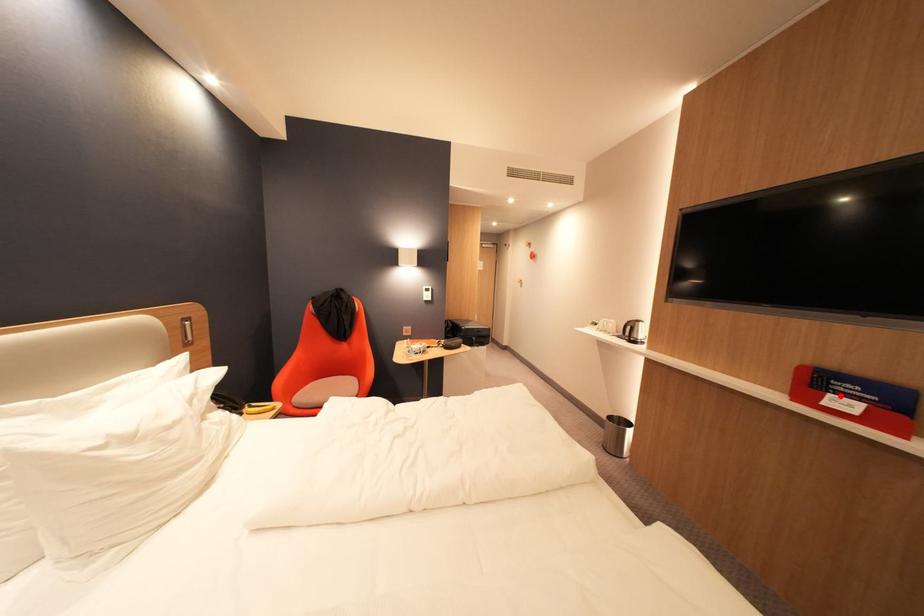
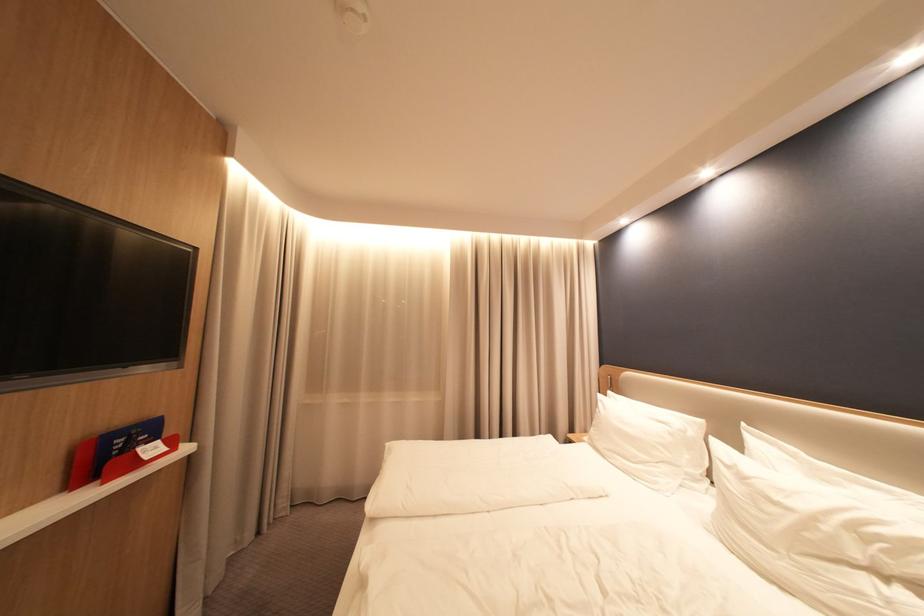
Find the pixel in the second image that matches the highlighted location in the first image.

(150, 452)